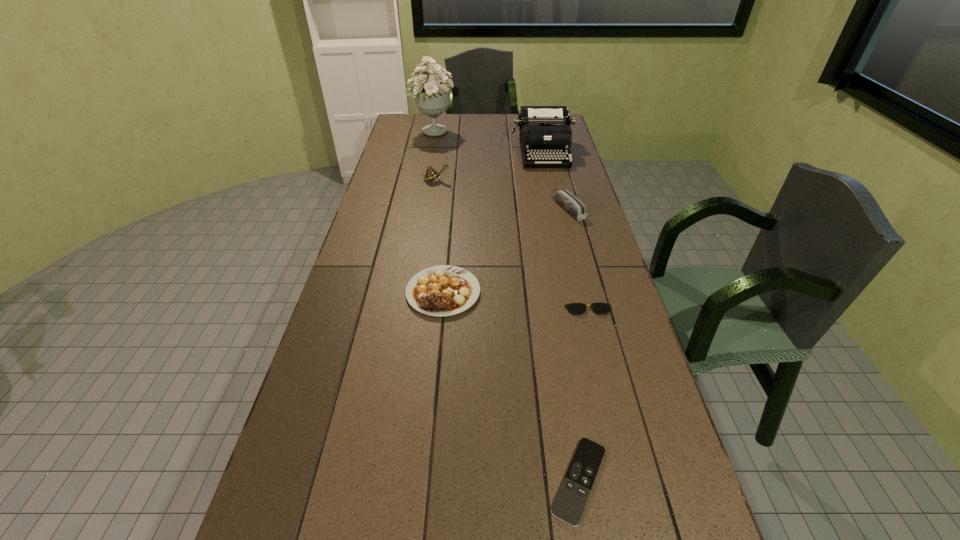
Where is `bouquet`? bouquet is located at coordinates (433, 98).

Where is `the second tallest object`? The width and height of the screenshot is (960, 540). the second tallest object is located at coordinates (545, 134).

This screenshot has width=960, height=540. What are the coordinates of `the third farthest object` in the screenshot? It's located at (431, 175).

Where is `snail`? The width and height of the screenshot is (960, 540). snail is located at coordinates (431, 175).

I want to click on the fourth shortest object, so click(x=568, y=201).

At what (x,y) coordinates should I click in order to perform the action: click on pencil box. Please return your answer as a coordinate pair (x, y). The height and width of the screenshot is (540, 960). Looking at the image, I should click on (568, 201).

Identify the location of steak. The width and height of the screenshot is (960, 540). (444, 290).

In order to click on spectacles in this screenshot , I will do `click(574, 308)`.

I want to click on remote control, so click(x=573, y=494).

Where is `vacant point located on the back of the bouquet`? Image resolution: width=960 pixels, height=540 pixels. vacant point located on the back of the bouquet is located at coordinates [x=436, y=116].